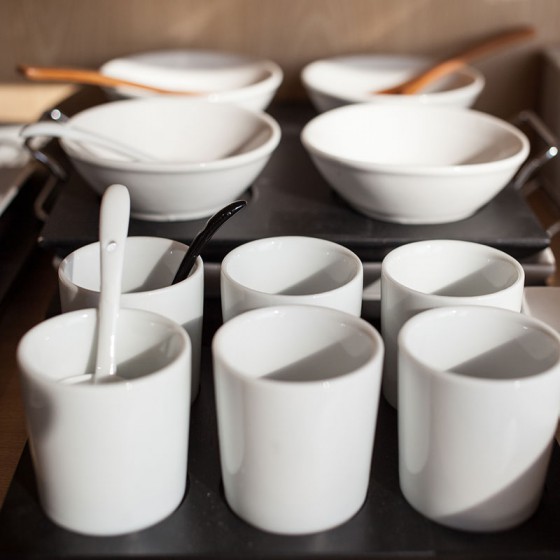
I want to click on mug, so coord(122,459), coord(268,440), coord(298,296), coord(170,300), coord(413,283), coord(441,407).